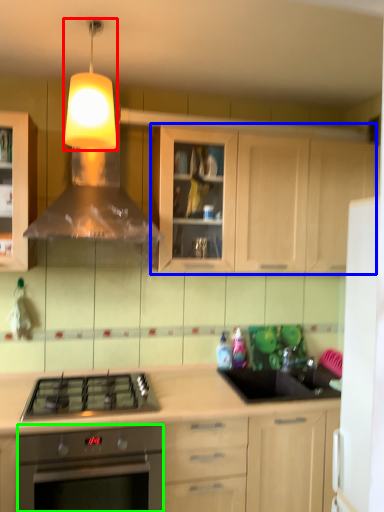
Question: Considering the real-world distances, which object is farthest from light fixture (highlighted by a red box)? cabinetry (highlighted by a blue box) or oven (highlighted by a green box)?

Choices:
 (A) cabinetry
 (B) oven

Answer: (B)